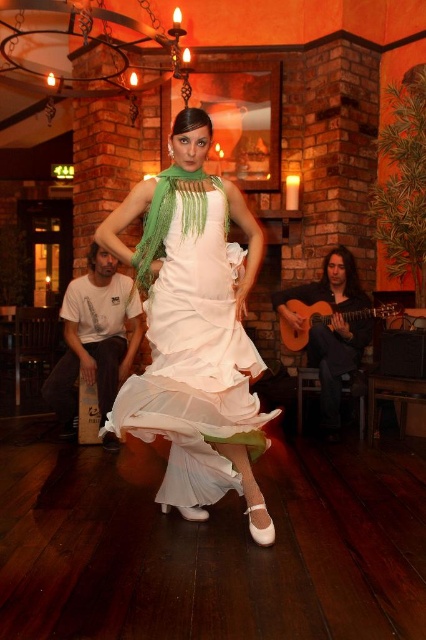
Is white satin dress at center above acoustic wood guitar at right?

No.

Who is lower down, white satin dress at center or acoustic wood guitar at right?

white satin dress at center is below.

Is point (193, 204) positioned after point (308, 330)?

No, it is in front of (308, 330).

The height and width of the screenshot is (640, 426). Find the location of `white satin dress at center`. white satin dress at center is located at coordinates (193, 355).